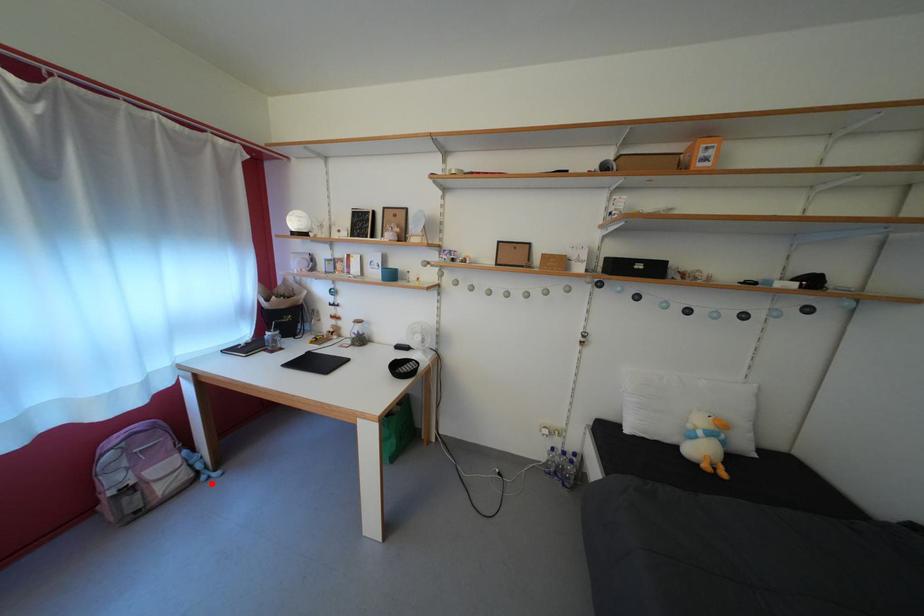
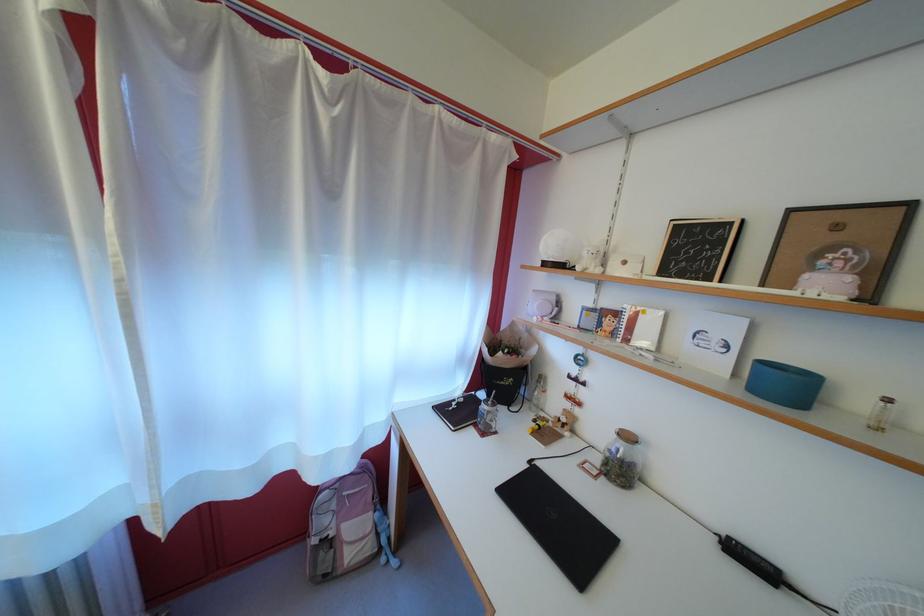
Locate, in the second image, the point that corresponds to the highlighted location in the first image.

(392, 565)